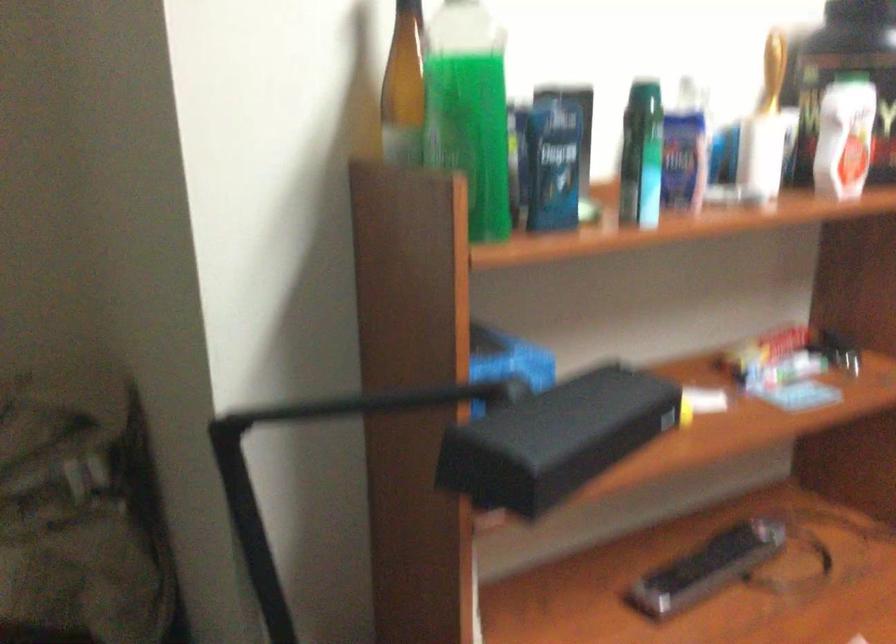
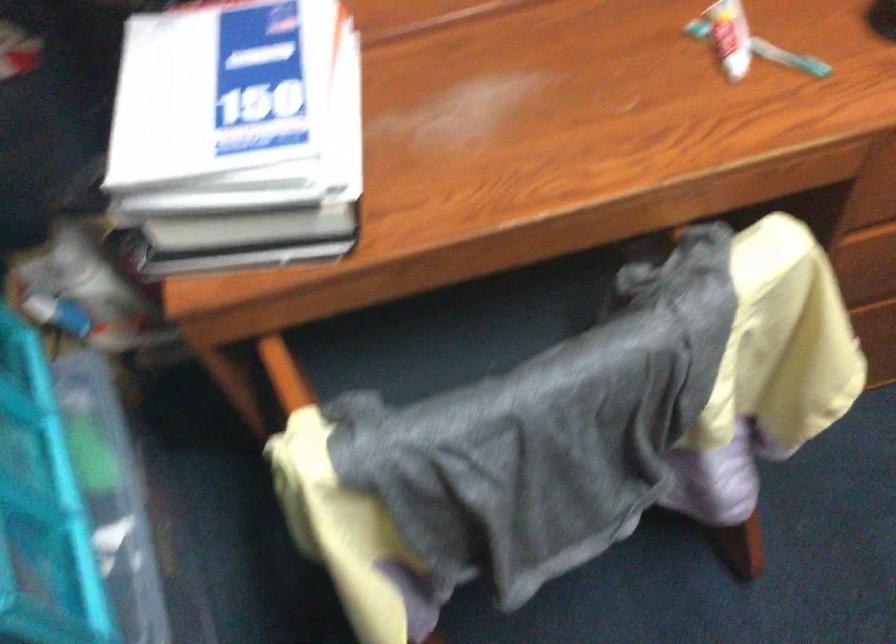
First-person continuous shooting, in which direction is the camera rotating?

The camera's rotation is toward left-down.